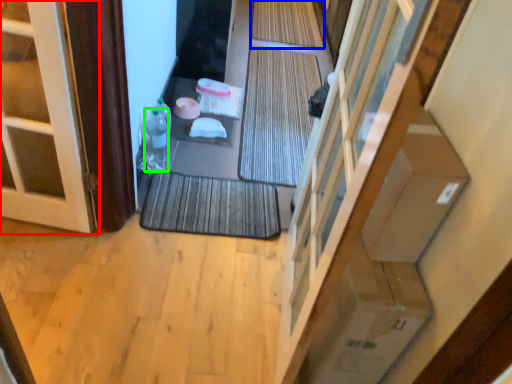
Question: Which object is the farthest from door (highlighted by a red box)? Choose among these: bath mat (highlighted by a blue box) or bottle (highlighted by a green box).

Choices:
 (A) bath mat
 (B) bottle

Answer: (A)